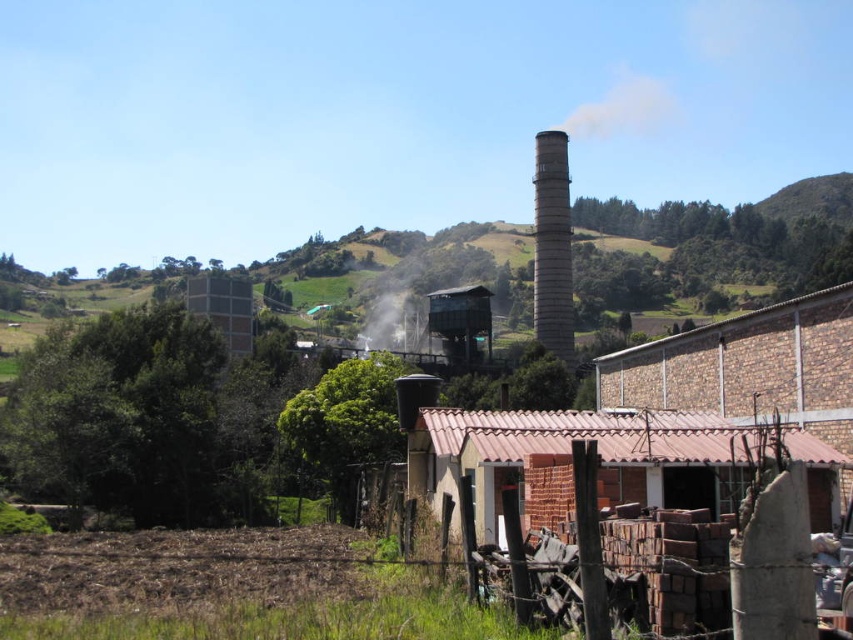
Does gray concrete chimney at upper center have a greater height compared to metallic gray tower at center?

Indeed, gray concrete chimney at upper center has a greater height compared to metallic gray tower at center.

Can you confirm if gray concrete chimney at upper center is thinner than metallic gray tower at center?

Indeed, gray concrete chimney at upper center has a lesser width compared to metallic gray tower at center.

Is point (560, 200) farther from camera compared to point (463, 317)?

Yes, point (560, 200) is farther from viewer.

At what (x,y) coordinates should I click in order to perform the action: click on gray concrete chimney at upper center. Please return your answer as a coordinate pair (x, y). This screenshot has height=640, width=853. Looking at the image, I should click on (552, 246).

Based on the photo, is brown brick hut at lower right bigger than gray concrete chimney at upper center?

Incorrect, brown brick hut at lower right is not larger than gray concrete chimney at upper center.

Does brown brick hut at lower right have a lesser height compared to gray concrete chimney at upper center?

Indeed, brown brick hut at lower right has a lesser height compared to gray concrete chimney at upper center.

At what (x,y) coordinates should I click in order to perform the action: click on brown brick hut at lower right. Please return your answer as a coordinate pair (x, y). The width and height of the screenshot is (853, 640). Looking at the image, I should click on (569, 451).

At what (x,y) coordinates should I click in order to perform the action: click on brown brick hut at lower right. Please return your answer as a coordinate pair (x, y). This screenshot has width=853, height=640. Looking at the image, I should click on (569, 451).

Locate an element on the screen. The image size is (853, 640). brown wooden fence at lower right is located at coordinates (668, 570).

Is brown wooden fence at lower right to the right of gray concrete chimney at upper center from the viewer's perspective?

Incorrect, brown wooden fence at lower right is not on the right side of gray concrete chimney at upper center.

Is point (721, 547) farther from camera compared to point (543, 284)?

That is False.

Where is `brown wooden fence at lower right`? brown wooden fence at lower right is located at coordinates coord(668,570).